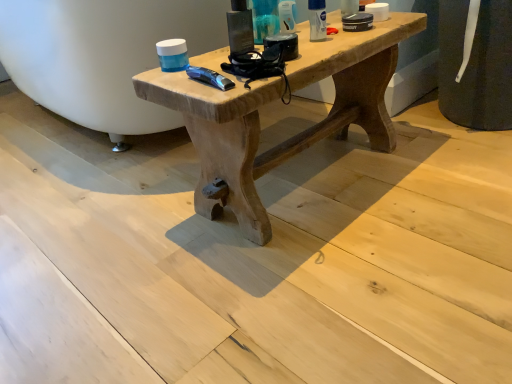
Question: From a real-world perspective, does translucent plastic tube at upper center, the second toiletry in the right-to-left sequence, sit lower than natural wood table at center?

Choices:
 (A) no
 (B) yes

Answer: (A)

Question: Is the position of translucent plastic tube at upper center, the second toiletry in the right-to-left sequence, more distant than that of natural wood table at center?

Choices:
 (A) no
 (B) yes

Answer: (B)

Question: Does translucent plastic tube at upper center, the second toiletry in the right-to-left sequence, appear on the left side of natural wood table at center?

Choices:
 (A) yes
 (B) no

Answer: (A)

Question: Can you see translucent plastic tube at upper center, the second toiletry in the right-to-left sequence, touching natural wood table at center?

Choices:
 (A) no
 (B) yes

Answer: (A)

Question: From the image's perspective, would you say translucent plastic tube at upper center, the second toiletry in the right-to-left sequence, is shown under natural wood table at center?

Choices:
 (A) yes
 (B) no

Answer: (B)

Question: Does translucent plastic tube at upper center, the second toiletry viewed from the left, have a larger size compared to natural wood table at center?

Choices:
 (A) yes
 (B) no

Answer: (B)

Question: Is matte plastic container at upper center, the 1th toiletry viewed from the left, bigger than white matte deodorant at upper right, the first toiletry from the right?

Choices:
 (A) no
 (B) yes

Answer: (B)

Question: Is matte plastic container at upper center, the 1th toiletry viewed from the left, shorter than white matte deodorant at upper right, the first toiletry from the right?

Choices:
 (A) yes
 (B) no

Answer: (B)

Question: Would you say matte plastic container at upper center, the 1th toiletry viewed from the left, is outside white matte deodorant at upper right, the first toiletry from the right?

Choices:
 (A) no
 (B) yes

Answer: (B)

Question: Can you confirm if matte plastic container at upper center, the 1th toiletry viewed from the left, is smaller than white matte deodorant at upper right, the first toiletry from the right?

Choices:
 (A) no
 (B) yes

Answer: (A)

Question: Is matte plastic container at upper center, the 1th toiletry viewed from the left, further to the viewer compared to white matte deodorant at upper right, the first toiletry from the right?

Choices:
 (A) yes
 (B) no

Answer: (B)

Question: Considering the relative sizes of matte plastic container at upper center, the 1th toiletry viewed from the left, and white matte deodorant at upper right, the first toiletry from the right, in the image provided, is matte plastic container at upper center, the 1th toiletry viewed from the left, thinner than white matte deodorant at upper right, the first toiletry from the right,?

Choices:
 (A) no
 (B) yes

Answer: (A)

Question: Can you confirm if natural wood table at center is thinner than translucent plastic tube at upper center, the second toiletry in the right-to-left sequence?

Choices:
 (A) no
 (B) yes

Answer: (A)